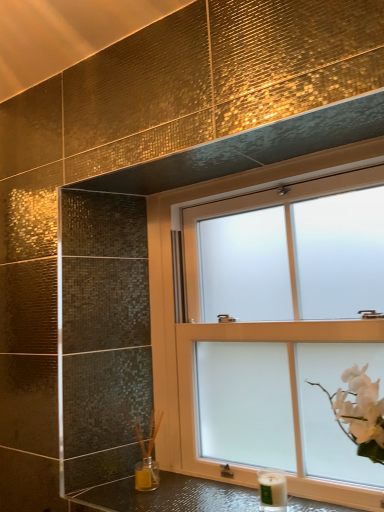
Question: In the image, is white matte candle at lower right positioned in front of or behind shiny metallic counter top at lower center?

Choices:
 (A) behind
 (B) front

Answer: (A)

Question: Which is correct: white matte candle at lower right is inside shiny metallic counter top at lower center, or outside of it?

Choices:
 (A) outside
 (B) inside

Answer: (A)

Question: Estimate the real-world distances between objects in this image. Which object is closer to the shiny metallic counter top at lower center?

Choices:
 (A) frosted glass window at upper center
 (B) white matte candle at lower right

Answer: (B)

Question: Which of these objects is positioned farthest from the frosted glass window at upper center?

Choices:
 (A) shiny metallic counter top at lower center
 (B) white matte candle at lower right

Answer: (B)